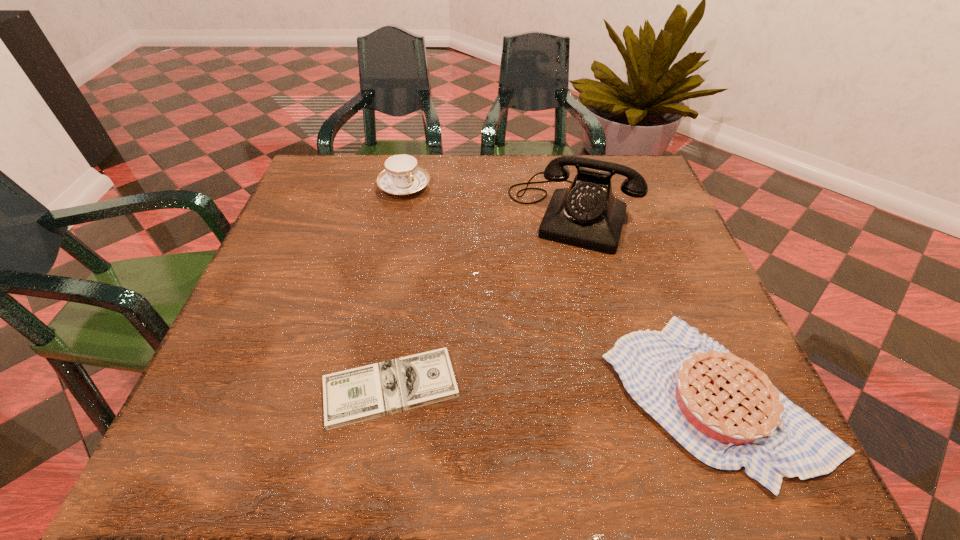
Image resolution: width=960 pixels, height=540 pixels. I want to click on the shortest object, so coord(355,395).

This screenshot has width=960, height=540. What are the coordinates of `pie` in the screenshot? It's located at (725, 411).

Where is `telephone`? This screenshot has width=960, height=540. telephone is located at coordinates (586, 214).

What are the coordinates of `teacup` in the screenshot? It's located at (402, 176).

Identify the location of blank space located 0.110m on the back of the dollar. The height and width of the screenshot is (540, 960). (404, 306).

Identify the location of vacant region located on the back of the third tallest object. The height and width of the screenshot is (540, 960). (636, 204).

Locate an element on the screen. Image resolution: width=960 pixels, height=540 pixels. free region located on the front face of the tallest object is located at coordinates (519, 364).

What are the coordinates of `vacant region located 0.190m on the front face of the tallest object` in the screenshot? It's located at (537, 315).

Find the location of `vacant point located 0.260m on the front face of the tallest object`. vacant point located 0.260m on the front face of the tallest object is located at coordinates (527, 343).

Identify the location of vacant space situated 0.170m on the side with the handle of the second tallest object. The height and width of the screenshot is (540, 960). (451, 237).